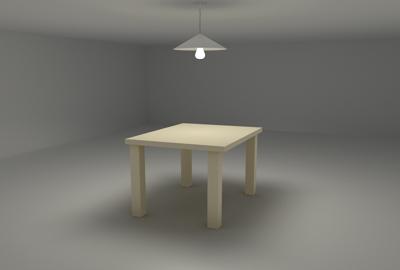
What are the coordinates of `pale color ceiling` in the screenshot? It's located at (312, 14).